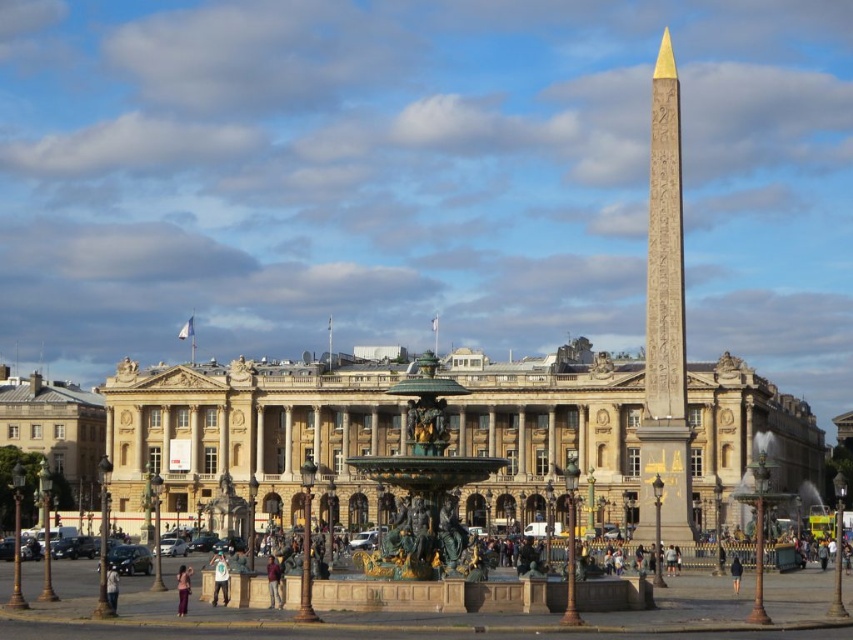
Is gold polished stone obelisk at center to the left of brown leather jacket at center from the viewer's perspective?

Incorrect, gold polished stone obelisk at center is not on the left side of brown leather jacket at center.

Is point (674, 289) positioned before point (276, 595)?

No, (674, 289) is further to viewer.

The height and width of the screenshot is (640, 853). Describe the element at coordinates (664, 321) in the screenshot. I see `gold polished stone obelisk at center` at that location.

Find the location of a particular element. gold polished stone obelisk at center is located at coordinates (664, 321).

Is point (660, 58) in front of point (112, 572)?

That is False.

Identify the location of gold polished stone obelisk at center. (664, 321).

Does matte gray building at left appear over denim pants at lower center?

Yes, matte gray building at left is above denim pants at lower center.

Does matte gray building at left have a greater width compared to denim pants at lower center?

Yes.

Which is in front, point (32, 412) or point (183, 605)?

Point (183, 605) is more forward.

Locate an element on the screen. The image size is (853, 640). matte gray building at left is located at coordinates (55, 426).